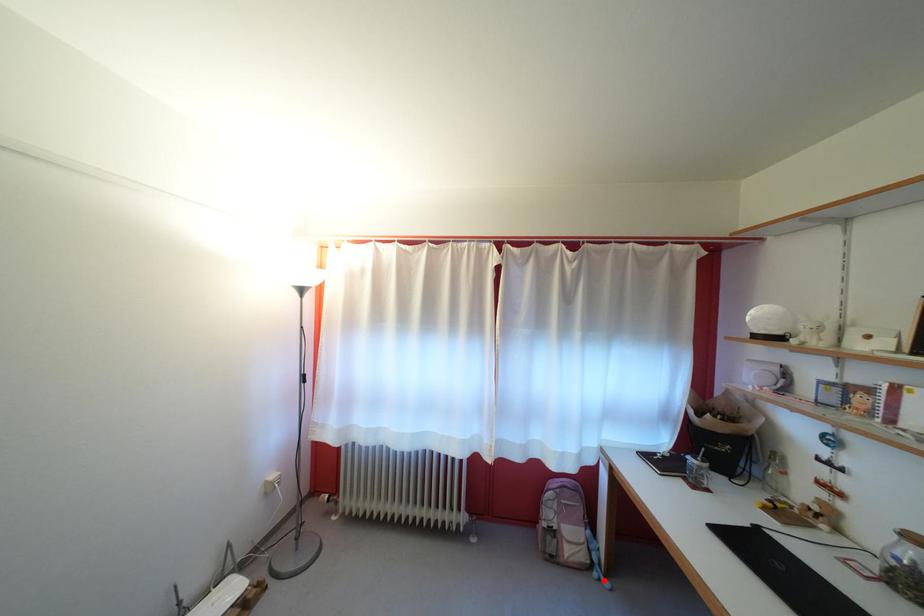
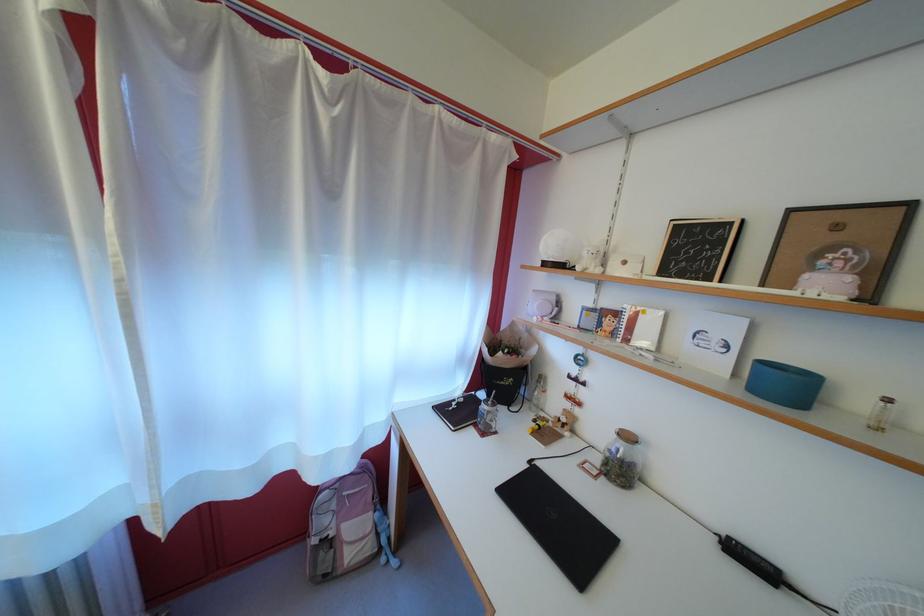
Question: I am providing you with two images of the same scene from different viewpoints. Given a red point in image1, look at the same physical point in image2. Is it:

Choices:
 (A) Closer to the viewpoint
 (B) Farther from the viewpoint

Answer: (B)